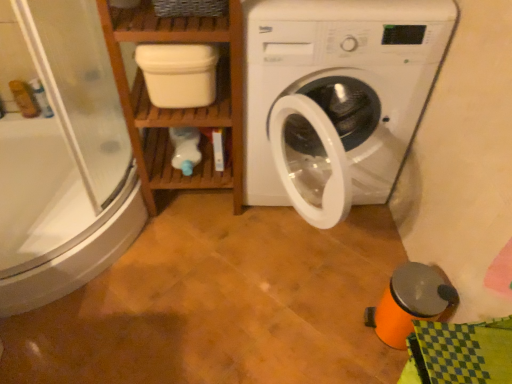
Question: Can you confirm if wooden shelf at left is wider than white plastic washing machine at center?

Choices:
 (A) yes
 (B) no

Answer: (B)

Question: Considering the relative sizes of wooden shelf at left and white plastic washing machine at center in the image provided, is wooden shelf at left bigger than white plastic washing machine at center?

Choices:
 (A) yes
 (B) no

Answer: (B)

Question: Is wooden shelf at left shorter than white plastic washing machine at center?

Choices:
 (A) yes
 (B) no

Answer: (B)

Question: From a real-world perspective, is wooden shelf at left located higher than white plastic washing machine at center?

Choices:
 (A) yes
 (B) no

Answer: (A)

Question: Does wooden shelf at left appear on the left side of white plastic washing machine at center?

Choices:
 (A) no
 (B) yes

Answer: (B)

Question: Does wooden shelf at left turn towards white plastic washing machine at center?

Choices:
 (A) no
 (B) yes

Answer: (A)

Question: Is wooden shelf at left at the left side of white matte container at upper center?

Choices:
 (A) yes
 (B) no

Answer: (A)

Question: Can you confirm if wooden shelf at left is shorter than white matte container at upper center?

Choices:
 (A) no
 (B) yes

Answer: (A)

Question: Does wooden shelf at left have a lesser width compared to white matte container at upper center?

Choices:
 (A) no
 (B) yes

Answer: (A)

Question: Is wooden shelf at left wider than white matte container at upper center?

Choices:
 (A) yes
 (B) no

Answer: (A)

Question: Is wooden shelf at left not within white matte container at upper center?

Choices:
 (A) yes
 (B) no

Answer: (A)

Question: Can you confirm if wooden shelf at left is bigger than white matte container at upper center?

Choices:
 (A) yes
 (B) no

Answer: (A)

Question: Does transparent glass shower door at left have a greater width compared to wooden shelf at left?

Choices:
 (A) no
 (B) yes

Answer: (B)